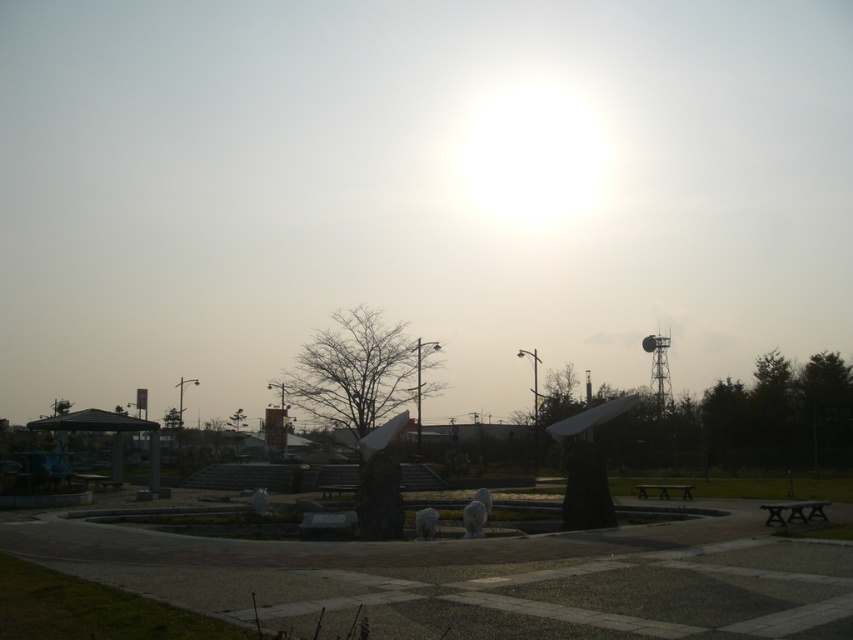
Consider the image. You are standing on the paved area looking towards the horizon where the sun is. Which tree, the bare wood tree at center or the green matte tree at lower left, would cast a longer shadow towards you?

The bare wood tree at center is located above the green matte tree at lower left. Since the sun is low in the sky, the higher positioned tree will cast a longer shadow towards you.

You are standing on the paved area looking towards the horizon where the sun is. There are two points marked on the ground in front of you. One is at point (717, 417) and the other is at point (653, 486). Which point is closer to you?

Point (653, 486) is closer to you because point (717, 417) is behind it.